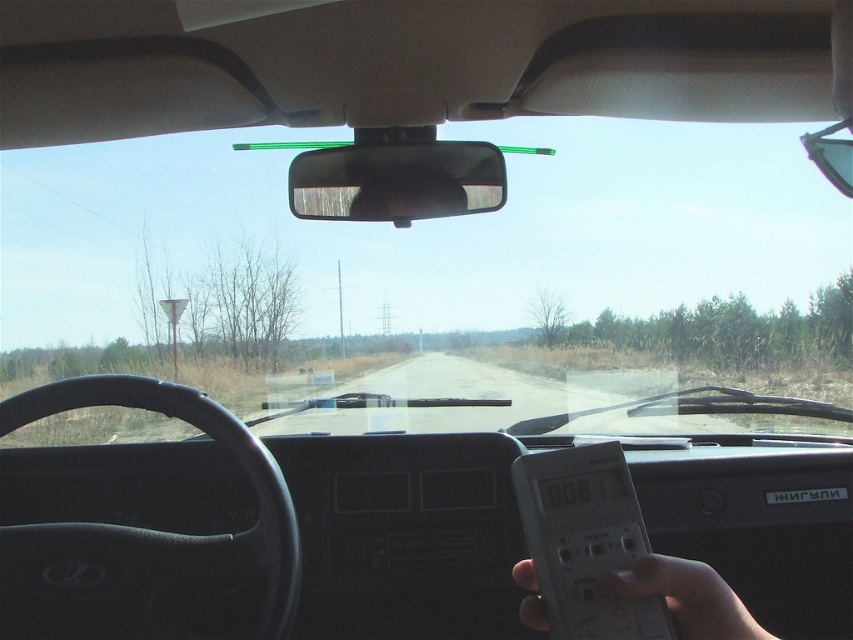
Question: Can you confirm if black glossy view mirror at center is positioned to the left of white plastic remote at lower right?

Choices:
 (A) no
 (B) yes

Answer: (B)

Question: Is black glossy view mirror at center further to camera compared to white plastic remote at lower right?

Choices:
 (A) no
 (B) yes

Answer: (B)

Question: Among these objects, which one is farthest from the camera?

Choices:
 (A) white plastic remote at lower right
 (B) white plastic remote at right
 (C) black glossy view mirror at center

Answer: (C)

Question: Which is nearer to the black glossy view mirror at center?

Choices:
 (A) white plastic remote at right
 (B) white plastic remote at lower right

Answer: (A)

Question: Is white plastic remote at right further to the viewer compared to black glossy view mirror at center?

Choices:
 (A) yes
 (B) no

Answer: (B)

Question: Which point is farther to the camera?

Choices:
 (A) white plastic remote at right
 (B) black glossy view mirror at center
 (C) white plastic remote at lower right

Answer: (B)